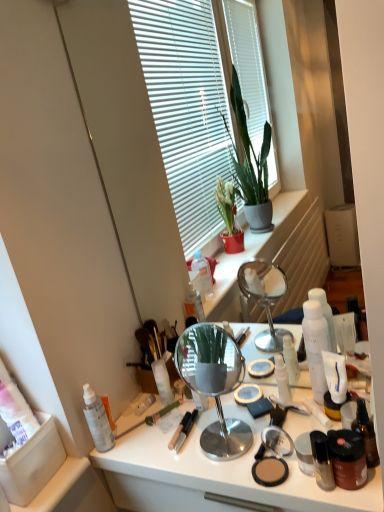
Find the location of a particular element. The image size is (384, 512). free area in between transparent plastic spray bottle at left, the 7th toiletry in the right-to-left sequence, and shiny black bottle at lower right, which is counted as the fourth toiletry, starting from the left is located at coordinates (192, 464).